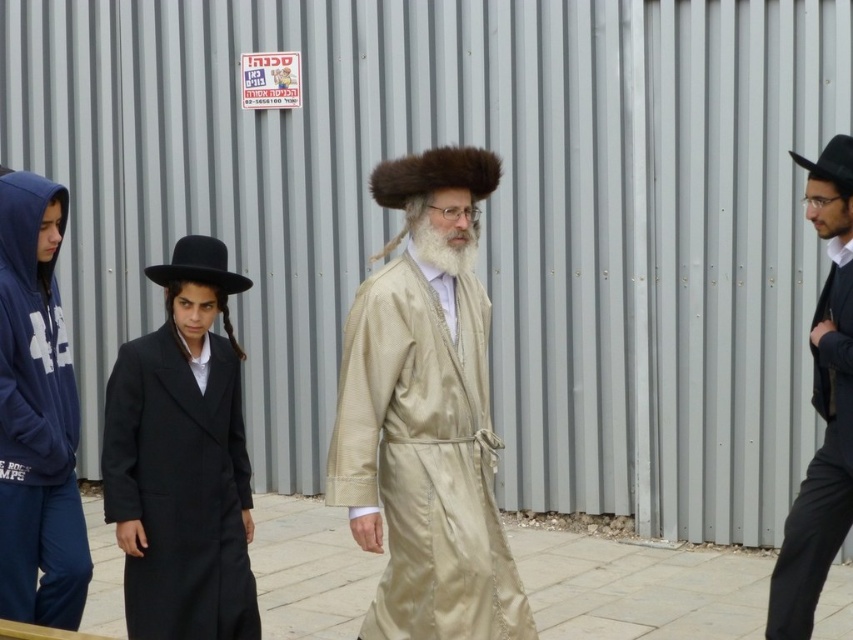
You are a photographer who wants to capture both the black satin hat at right and the fuzzy brown hat at center in a single frame. Which hat should you focus on first to ensure both are in the shot?

The black satin hat at right is positioned under the fuzzy brown hat at center. To capture both in a single frame, focus on the fuzzy brown hat at center first as it is above the black satin hat at right, ensuring both are visible.

You are standing in front of the metal wall and want to place a small plant between the two points, point [242,288] and point [450,273]. Which point is closer to you where you should start placing the plant?

Point [242,288] is closer to you than point [450,273], so you should start placing the plant near point [242,288].